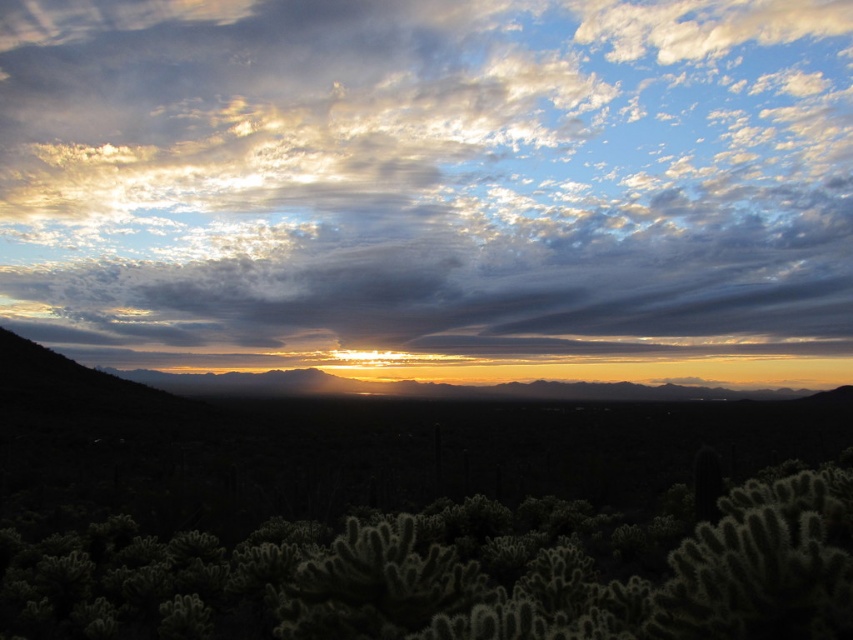
Question: Is cloudy sky at upper center above green spiky cactus at lower center?

Choices:
 (A) no
 (B) yes

Answer: (B)

Question: Can you confirm if cloudy sky at upper center is positioned to the right of green spiky cactus at lower center?

Choices:
 (A) yes
 (B) no

Answer: (B)

Question: Which point is closer to the camera?

Choices:
 (A) (3, 600)
 (B) (231, 97)

Answer: (A)

Question: Is cloudy sky at upper center further to camera compared to green spiky cactus at lower center?

Choices:
 (A) no
 (B) yes

Answer: (B)